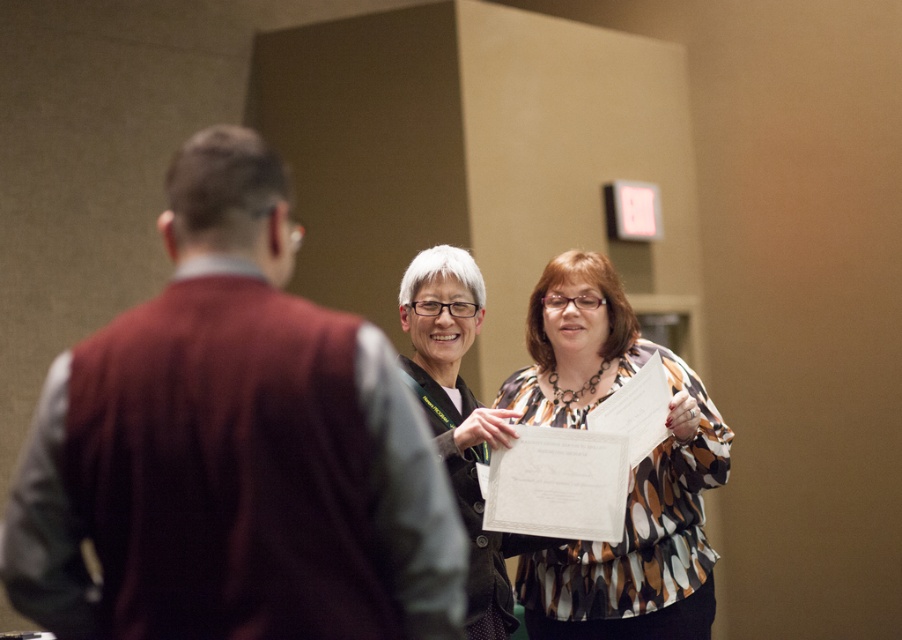
Which of these two, maroon sweater at left or multicolored printed blouse at center, stands shorter?

With less height is maroon sweater at left.

Is maroon sweater at left smaller than multicolored printed blouse at center?

Correct, maroon sweater at left occupies less space than multicolored printed blouse at center.

Between point (251, 387) and point (548, 291), which one is positioned in front?

Positioned in front is point (251, 387).

Locate an element on the screen. This screenshot has width=902, height=640. maroon sweater at left is located at coordinates (232, 449).

Looking at this image, is multicolored printed blouse at center positioned behind matte black jacket at center?

Yes, it is behind matte black jacket at center.

Looking at this image, between multicolored printed blouse at center and matte black jacket at center, which one is positioned lower?

multicolored printed blouse at center is below.

Between point (624, 557) and point (476, 284), which one is positioned behind?

The point (624, 557) is more distant.

In order to click on multicolored printed blouse at center in this screenshot , I will do `click(629, 476)`.

What do you see at coordinates (232, 449) in the screenshot?
I see `maroon sweater at left` at bounding box center [232, 449].

Does maroon sweater at left appear under matte black jacket at center?

Actually, maroon sweater at left is above matte black jacket at center.

Is point (382, 346) positioned after point (500, 426)?

No, it is in front of (500, 426).

Image resolution: width=902 pixels, height=640 pixels. In order to click on maroon sweater at left in this screenshot , I will do `click(232, 449)`.